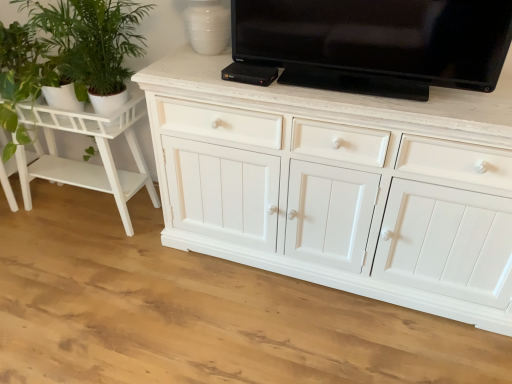
Question: Is black glossy tv at upper center taller than green leafy plant at left?

Choices:
 (A) no
 (B) yes

Answer: (A)

Question: From the image's perspective, does black glossy tv at upper center appear lower than green leafy plant at left?

Choices:
 (A) yes
 (B) no

Answer: (A)

Question: Is black glossy tv at upper center outside of green leafy plant at left?

Choices:
 (A) no
 (B) yes

Answer: (B)

Question: Is green leafy plant at left at the back of black glossy tv at upper center?

Choices:
 (A) yes
 (B) no

Answer: (B)

Question: From a real-world perspective, is black glossy tv at upper center over green leafy plant at left?

Choices:
 (A) yes
 (B) no

Answer: (A)

Question: Does black glossy tv at upper center have a greater width compared to green leafy plant at left?

Choices:
 (A) yes
 (B) no

Answer: (B)

Question: Is white painted wood side table at left thinner than green leafy plant at left?

Choices:
 (A) yes
 (B) no

Answer: (A)

Question: Is white painted wood side table at left at the left side of green leafy plant at left?

Choices:
 (A) yes
 (B) no

Answer: (A)

Question: From a real-world perspective, is white painted wood side table at left located higher than green leafy plant at left?

Choices:
 (A) yes
 (B) no

Answer: (B)

Question: Is the position of white painted wood side table at left more distant than that of green leafy plant at left?

Choices:
 (A) no
 (B) yes

Answer: (B)

Question: From a real-world perspective, is white painted wood side table at left beneath green leafy plant at left?

Choices:
 (A) no
 (B) yes

Answer: (B)

Question: Considering the relative positions of white painted wood side table at left and green leafy plant at left in the image provided, is white painted wood side table at left in front of green leafy plant at left?

Choices:
 (A) no
 (B) yes

Answer: (A)

Question: From the image's perspective, does green leafy plant at left appear lower than white painted wood side table at left?

Choices:
 (A) no
 (B) yes

Answer: (A)